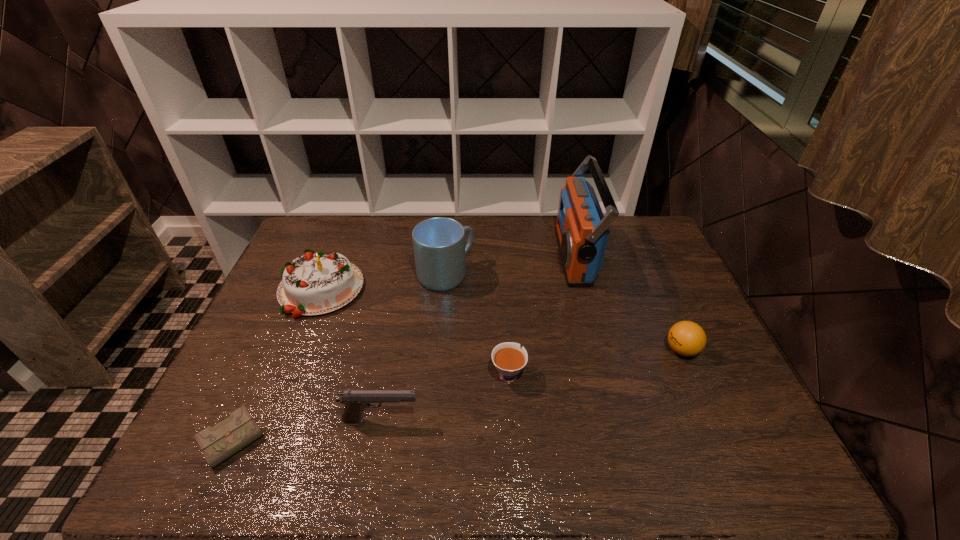
In the image, there is a desktop. Identify the location of free space at the near edge. The width and height of the screenshot is (960, 540). pos(289,454).

The width and height of the screenshot is (960, 540). In the image, there is a desktop. Identify the location of vacant region at the left edge. (247, 401).

Locate an element on the screen. This screenshot has width=960, height=540. vacant space at the right edge is located at coordinates (745, 426).

The width and height of the screenshot is (960, 540). In the image, there is a desktop. In order to click on free region at the far right corner in this screenshot , I will do `click(624, 216)`.

Find the location of `free space at the near right corner`. free space at the near right corner is located at coordinates (708, 466).

This screenshot has width=960, height=540. In order to click on free space between the diary and the radio receiver in this screenshot , I will do `click(405, 348)`.

I want to click on free point between the sixth tallest object and the tallest object, so click(541, 314).

Find the location of a particular element. The width and height of the screenshot is (960, 540). free spot between the mug and the third tallest object is located at coordinates (383, 282).

Where is `unoccupied position between the fifth tallest object and the sixth tallest object`? Image resolution: width=960 pixels, height=540 pixels. unoccupied position between the fifth tallest object and the sixth tallest object is located at coordinates (595, 362).

You are a GUI agent. You are given a task and a screenshot of the screen. Output one action in this format:
    pyautogui.click(x=<x>, y=<y>)
    Task: Click on the vacant point located between the second shortest object and the third tallest object
    The height and width of the screenshot is (540, 960).
    Given the screenshot: What is the action you would take?
    pyautogui.click(x=414, y=331)